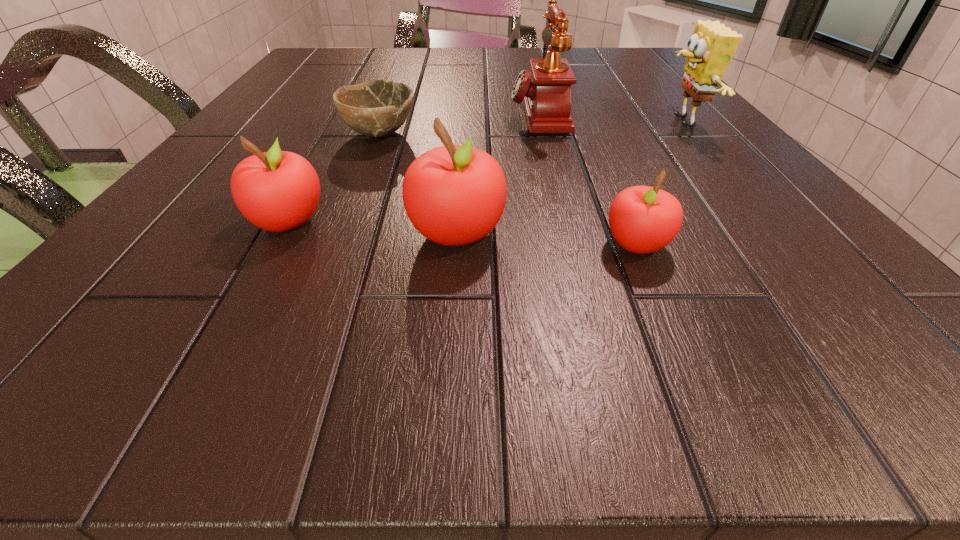
Image resolution: width=960 pixels, height=540 pixels. Find the location of `blank space that satisfies the following two spatial constraints: 1. on the back side of the shortest apple; 2. on the dial of the telephone`. blank space that satisfies the following two spatial constraints: 1. on the back side of the shortest apple; 2. on the dial of the telephone is located at coordinates (581, 114).

This screenshot has height=540, width=960. Identify the location of free location that satisfies the following two spatial constraints: 1. on the dial of the telephone; 2. on the front side of the third object from left to right. [x=566, y=233].

At what (x,y) coordinates should I click in order to perform the action: click on vacant space that satisfies the following two spatial constraints: 1. on the dial of the second shortest object; 2. on the left side of the telephone. Please return your answer as a coordinate pair (x, y). The image size is (960, 540). Looking at the image, I should click on (x=569, y=245).

Find the location of a particular element. free space that satisfies the following two spatial constraints: 1. on the dial of the telephone; 2. on the front side of the fourth object from right to left is located at coordinates 566,233.